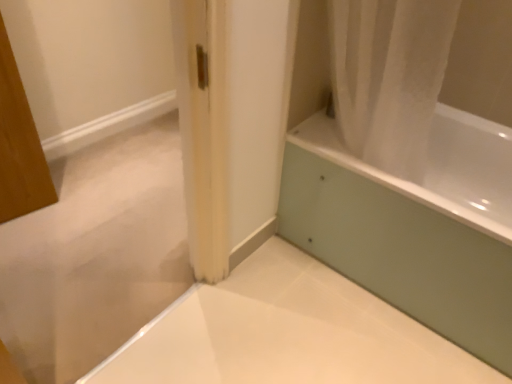
Question: From the image's perspective, relative to white glossy bathtub at lower right, is white glossy bathtub at upper right above or below?

Choices:
 (A) above
 (B) below

Answer: (A)

Question: Is white glossy bathtub at upper right bigger or smaller than white glossy bathtub at lower right?

Choices:
 (A) big
 (B) small

Answer: (B)

Question: Considering the positions of white glossy bathtub at upper right and white glossy bathtub at lower right in the image, is white glossy bathtub at upper right wider or thinner than white glossy bathtub at lower right?

Choices:
 (A) thin
 (B) wide

Answer: (A)

Question: Is point (357, 236) positioned closer to the camera than point (306, 142)?

Choices:
 (A) closer
 (B) farther

Answer: (B)

Question: In the image, is white glossy bathtub at lower right positioned in front of or behind white glossy bathtub at upper right?

Choices:
 (A) front
 (B) behind

Answer: (B)

Question: Visually, is white glossy bathtub at lower right positioned to the left or to the right of white glossy bathtub at upper right?

Choices:
 (A) right
 (B) left

Answer: (A)

Question: From a real-world perspective, is white glossy bathtub at lower right positioned above or below white glossy bathtub at upper right?

Choices:
 (A) below
 (B) above

Answer: (A)